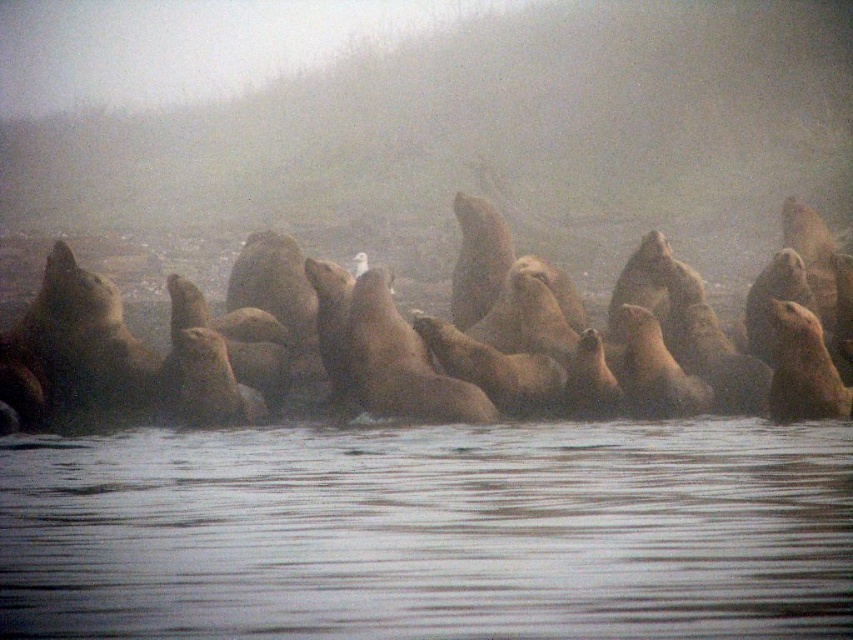
Question: Considering the relative positions of clear water at lower center and light brown fur seal at center in the image provided, where is clear water at lower center located with respect to light brown fur seal at center?

Choices:
 (A) below
 (B) above

Answer: (A)

Question: Is clear water at lower center to the right of light brown fur seal at center from the viewer's perspective?

Choices:
 (A) yes
 (B) no

Answer: (B)

Question: Among these objects, which one is farthest from the camera?

Choices:
 (A) light brown fur seal at center
 (B) clear water at lower center

Answer: (A)

Question: Does clear water at lower center appear on the right side of light brown fur seal at center?

Choices:
 (A) yes
 (B) no

Answer: (B)

Question: Which point is farther to the camera?

Choices:
 (A) light brown fur seal at center
 (B) clear water at lower center

Answer: (A)